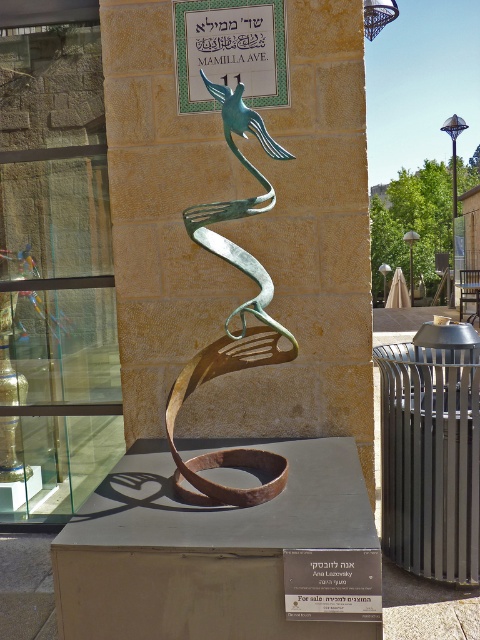
Question: Does green patina metal bird at center have a lesser width compared to green metallic sign at upper center?

Choices:
 (A) no
 (B) yes

Answer: (B)

Question: Among these objects, which one is farthest from the camera?

Choices:
 (A) green metallic sign at upper center
 (B) green patina metal bird at center

Answer: (A)

Question: Does green patina metal bird at center appear over green metallic sign at upper center?

Choices:
 (A) yes
 (B) no

Answer: (B)

Question: Does green patina metal bird at center have a lesser width compared to green metallic sign at upper center?

Choices:
 (A) no
 (B) yes

Answer: (B)